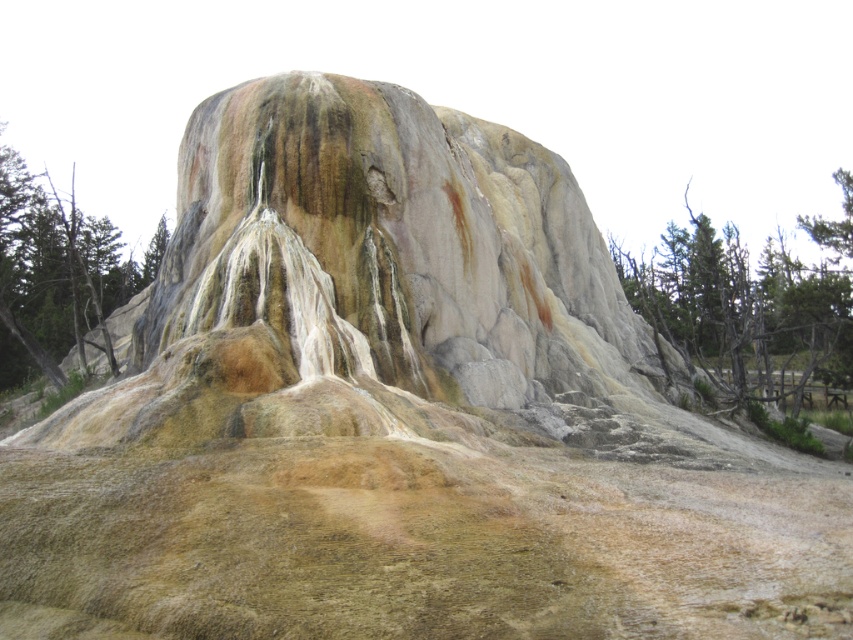
Question: Which point is farther to the camera?

Choices:
 (A) click(x=83, y=312)
 (B) click(x=767, y=252)

Answer: (B)

Question: Observing the image, what is the correct spatial positioning of green leafy trees at upper right in reference to green rough bark tree at left?

Choices:
 (A) right
 (B) left

Answer: (A)

Question: Which point is closer to the camera?

Choices:
 (A) green leafy trees at upper right
 (B) green rough bark tree at left

Answer: (B)

Question: Does green leafy trees at upper right have a lesser width compared to green rough bark tree at left?

Choices:
 (A) no
 (B) yes

Answer: (B)

Question: Is green leafy trees at upper right smaller than green rough bark tree at left?

Choices:
 (A) no
 (B) yes

Answer: (B)